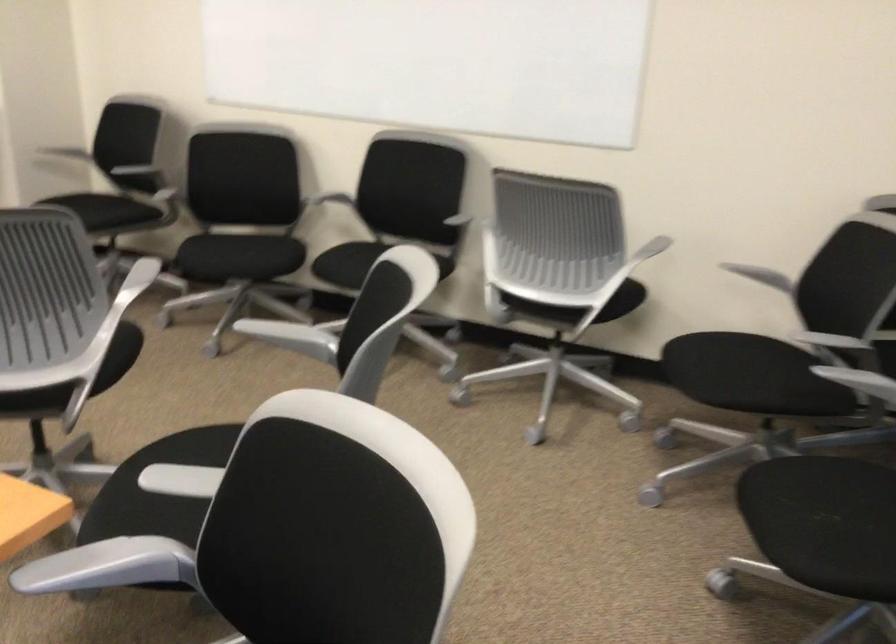
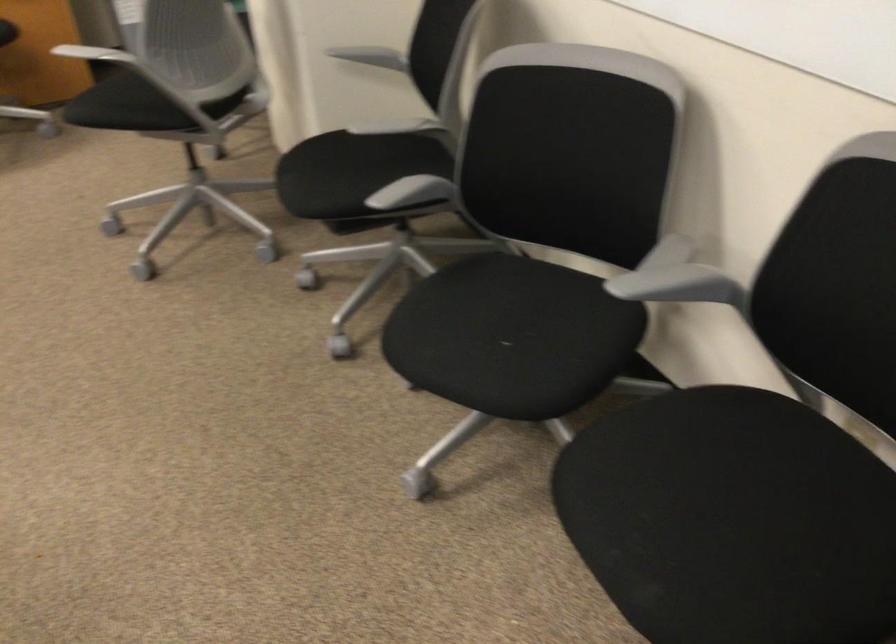
Locate, in the second image, the point that corresponds to (245,251) in the first image.

(494, 337)